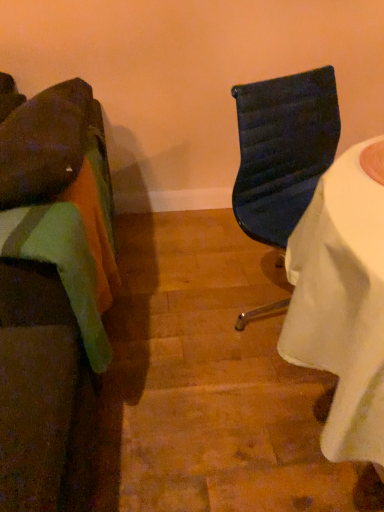
Identify the location of velvet green cushion at left, marked as the 2th chair in a right-to-left arrangement. (51, 289).

Describe the element at coordinates (51, 289) in the screenshot. I see `velvet green cushion at left, the 1th chair in the left-to-right sequence` at that location.

I want to click on matte black chair at center, which is the second chair from left to right, so click(283, 150).

The height and width of the screenshot is (512, 384). Describe the element at coordinates (283, 150) in the screenshot. I see `matte black chair at center, placed as the 1th chair when sorted from right to left` at that location.

Locate an element on the screen. velvet green cushion at left, the 1th chair in the left-to-right sequence is located at coordinates (51, 289).

Which object is positioned more to the right, matte black chair at center, placed as the 1th chair when sorted from right to left, or velvet green cushion at left, the 1th chair in the left-to-right sequence?

matte black chair at center, placed as the 1th chair when sorted from right to left, is more to the right.

Considering the positions of objects matte black chair at center, placed as the 1th chair when sorted from right to left, and velvet green cushion at left, marked as the 2th chair in a right-to-left arrangement, in the image provided, who is in front, matte black chair at center, placed as the 1th chair when sorted from right to left, or velvet green cushion at left, marked as the 2th chair in a right-to-left arrangement,?

velvet green cushion at left, marked as the 2th chair in a right-to-left arrangement.

Between point (236, 95) and point (11, 388), which one is positioned behind?

The point (236, 95) is behind.

From the image's perspective, which is above, matte black chair at center, placed as the 1th chair when sorted from right to left, or velvet green cushion at left, the 1th chair in the left-to-right sequence?

matte black chair at center, placed as the 1th chair when sorted from right to left, is shown above in the image.

From a real-world perspective, is matte black chair at center, placed as the 1th chair when sorted from right to left, physically located above or below velvet green cushion at left, the 1th chair in the left-to-right sequence?

matte black chair at center, placed as the 1th chair when sorted from right to left, is above velvet green cushion at left, the 1th chair in the left-to-right sequence.

Considering the relative sizes of matte black chair at center, placed as the 1th chair when sorted from right to left, and velvet green cushion at left, the 1th chair in the left-to-right sequence, in the image provided, is matte black chair at center, placed as the 1th chair when sorted from right to left, wider than velvet green cushion at left, the 1th chair in the left-to-right sequence,?

Incorrect, the width of matte black chair at center, placed as the 1th chair when sorted from right to left, does not surpass that of velvet green cushion at left, the 1th chair in the left-to-right sequence.

Can you confirm if matte black chair at center, which is the second chair from left to right, is taller than velvet green cushion at left, marked as the 2th chair in a right-to-left arrangement?

Yes, matte black chair at center, which is the second chair from left to right, is taller than velvet green cushion at left, marked as the 2th chair in a right-to-left arrangement.

Considering the sizes of objects matte black chair at center, which is the second chair from left to right, and velvet green cushion at left, the 1th chair in the left-to-right sequence, in the image provided, who is smaller, matte black chair at center, which is the second chair from left to right, or velvet green cushion at left, the 1th chair in the left-to-right sequence,?

velvet green cushion at left, the 1th chair in the left-to-right sequence, is smaller.

Does matte black chair at center, which is the second chair from left to right, contain velvet green cushion at left, marked as the 2th chair in a right-to-left arrangement?

No, velvet green cushion at left, marked as the 2th chair in a right-to-left arrangement, is located outside of matte black chair at center, which is the second chair from left to right.

Consider the image. Can you see matte black chair at center, which is the second chair from left to right, touching velvet green cushion at left, the 1th chair in the left-to-right sequence?

There is a gap between matte black chair at center, which is the second chair from left to right, and velvet green cushion at left, the 1th chair in the left-to-right sequence.

Is matte black chair at center, which is the second chair from left to right, oriented away from velvet green cushion at left, marked as the 2th chair in a right-to-left arrangement?

No.

Identify the location of chair behind the velvet green cushion at left, the 1th chair in the left-to-right sequence. The width and height of the screenshot is (384, 512). (283, 150).

Based on the photo, which object is positioned more to the right, velvet green cushion at left, the 1th chair in the left-to-right sequence, or matte black chair at center, which is the second chair from left to right?

From the viewer's perspective, matte black chair at center, which is the second chair from left to right, appears more on the right side.

Is velvet green cushion at left, marked as the 2th chair in a right-to-left arrangement, closer to camera compared to matte black chair at center, placed as the 1th chair when sorted from right to left?

Yes, velvet green cushion at left, marked as the 2th chair in a right-to-left arrangement, is closer to the camera.

Is point (97, 154) more distant than point (268, 212)?

Yes, point (97, 154) is farther from viewer.

From the image's perspective, does velvet green cushion at left, marked as the 2th chair in a right-to-left arrangement, appear lower than matte black chair at center, placed as the 1th chair when sorted from right to left?

Yes.

From a real-world perspective, does velvet green cushion at left, the 1th chair in the left-to-right sequence, stand above matte black chair at center, placed as the 1th chair when sorted from right to left?

Incorrect, from a real-world perspective, velvet green cushion at left, the 1th chair in the left-to-right sequence, is lower than matte black chair at center, placed as the 1th chair when sorted from right to left.

Based on the photo, does velvet green cushion at left, marked as the 2th chair in a right-to-left arrangement, have a greater width compared to matte black chair at center, which is the second chair from left to right?

Yes, velvet green cushion at left, marked as the 2th chair in a right-to-left arrangement, is wider than matte black chair at center, which is the second chair from left to right.

Can you confirm if velvet green cushion at left, marked as the 2th chair in a right-to-left arrangement, is shorter than matte black chair at center, which is the second chair from left to right?

Indeed, velvet green cushion at left, marked as the 2th chair in a right-to-left arrangement, has a lesser height compared to matte black chair at center, which is the second chair from left to right.

Does velvet green cushion at left, the 1th chair in the left-to-right sequence, have a smaller size compared to matte black chair at center, placed as the 1th chair when sorted from right to left?

Yes.

Do you think velvet green cushion at left, the 1th chair in the left-to-right sequence, is within matte black chair at center, which is the second chair from left to right, or outside of it?

velvet green cushion at left, the 1th chair in the left-to-right sequence, cannot be found inside matte black chair at center, which is the second chair from left to right.

Is the surface of velvet green cushion at left, the 1th chair in the left-to-right sequence, in direct contact with matte black chair at center, placed as the 1th chair when sorted from right to left?

There is a gap between velvet green cushion at left, the 1th chair in the left-to-right sequence, and matte black chair at center, placed as the 1th chair when sorted from right to left.

Is velvet green cushion at left, the 1th chair in the left-to-right sequence, looking in the opposite direction of matte black chair at center, placed as the 1th chair when sorted from right to left?

No.

Find the location of a particular element. The width and height of the screenshot is (384, 512). chair that is above the velvet green cushion at left, the 1th chair in the left-to-right sequence (from the image's perspective) is located at coordinates (283, 150).

In order to click on chair on the right of velvet green cushion at left, the 1th chair in the left-to-right sequence in this screenshot , I will do click(283, 150).

Where is `chair that is in front of the matte black chair at center, placed as the 1th chair when sorted from right to left`? chair that is in front of the matte black chair at center, placed as the 1th chair when sorted from right to left is located at coordinates (51, 289).